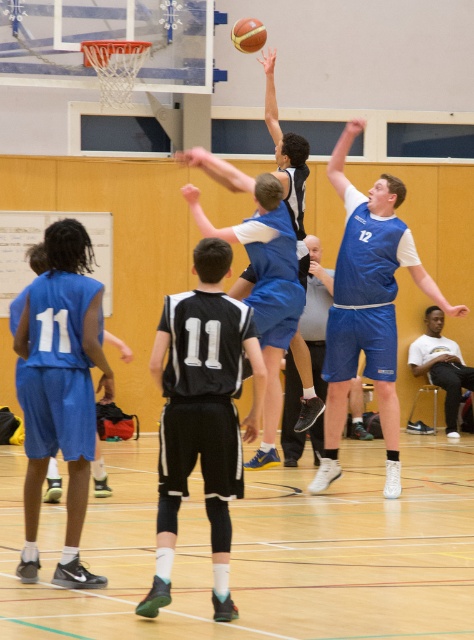
Question: Among these objects, which one is nearest to the camera?

Choices:
 (A) orange rubber basketball at upper center
 (B) blue jersey at center
 (C) white cotton shirt at center
 (D) black jersey at center

Answer: (D)

Question: Does matte blue shorts at left have a larger size compared to white cotton shirt at center?

Choices:
 (A) yes
 (B) no

Answer: (B)

Question: Which point is closer to the camera?

Choices:
 (A) matte blue shorts at left
 (B) white cotton shirt at center

Answer: (A)

Question: Is wooden floor at center positioned behind orange rubber basketball at upper center?

Choices:
 (A) yes
 (B) no

Answer: (B)

Question: Is black jersey at center above blue jersey at center?

Choices:
 (A) no
 (B) yes

Answer: (A)

Question: Which point is closer to the camera taking this photo?

Choices:
 (A) (431, 355)
 (B) (393, 189)
 (C) (472, 460)
 (D) (191, 424)

Answer: (D)